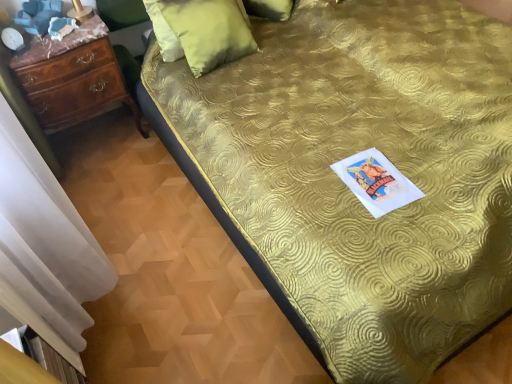
Question: Considering the relative sizes of mahogany wood chest of drawers at left and gold textured bedspread at center in the image provided, is mahogany wood chest of drawers at left smaller than gold textured bedspread at center?

Choices:
 (A) yes
 (B) no

Answer: (A)

Question: From the image's perspective, is mahogany wood chest of drawers at left below gold textured bedspread at center?

Choices:
 (A) no
 (B) yes

Answer: (A)

Question: Considering the relative sizes of mahogany wood chest of drawers at left and gold textured bedspread at center in the image provided, is mahogany wood chest of drawers at left bigger than gold textured bedspread at center?

Choices:
 (A) no
 (B) yes

Answer: (A)

Question: Would you say gold textured bedspread at center is part of mahogany wood chest of drawers at left's contents?

Choices:
 (A) no
 (B) yes

Answer: (A)

Question: Does mahogany wood chest of drawers at left lie in front of gold textured bedspread at center?

Choices:
 (A) yes
 (B) no

Answer: (B)

Question: Is mahogany wood chest of drawers at left bigger or smaller than velvet green pillow at upper center, which is counted as the second pillow, starting from the back?

Choices:
 (A) small
 (B) big

Answer: (B)

Question: Is mahogany wood chest of drawers at left to the left or to the right of velvet green pillow at upper center, which is counted as the second pillow, starting from the back, in the image?

Choices:
 (A) right
 (B) left

Answer: (B)

Question: Is mahogany wood chest of drawers at left spatially inside velvet green pillow at upper center, which is counted as the second pillow, starting from the back, or outside of it?

Choices:
 (A) outside
 (B) inside

Answer: (A)

Question: From a real-world perspective, relative to velvet green pillow at upper center, which is counted as the second pillow, starting from the back, is mahogany wood chest of drawers at left vertically above or below?

Choices:
 (A) below
 (B) above

Answer: (A)

Question: Is green velvet pillow at upper center, positioned as the 1th pillow in back-to-front order, situated inside mahogany wood chest of drawers at left or outside?

Choices:
 (A) outside
 (B) inside

Answer: (A)

Question: Is green velvet pillow at upper center, positioned as the 1th pillow in back-to-front order, taller or shorter than mahogany wood chest of drawers at left?

Choices:
 (A) tall
 (B) short

Answer: (B)

Question: From a real-world perspective, is green velvet pillow at upper center, positioned as the 1th pillow in back-to-front order, physically located above or below mahogany wood chest of drawers at left?

Choices:
 (A) below
 (B) above

Answer: (B)

Question: Considering the positions of point pyautogui.click(x=273, y=14) and point pyautogui.click(x=111, y=82), is point pyautogui.click(x=273, y=14) closer or farther from the camera than point pyautogui.click(x=111, y=82)?

Choices:
 (A) closer
 (B) farther

Answer: (B)

Question: Considering the positions of gold textured bedspread at center and velvet green pillow at upper center, which is counted as the second pillow, starting from the back, in the image, is gold textured bedspread at center bigger or smaller than velvet green pillow at upper center, which is counted as the second pillow, starting from the back,?

Choices:
 (A) small
 (B) big

Answer: (B)

Question: In the image, is gold textured bedspread at center positioned in front of or behind velvet green pillow at upper center, which is the 1th pillow in front-to-back order?

Choices:
 (A) front
 (B) behind

Answer: (A)